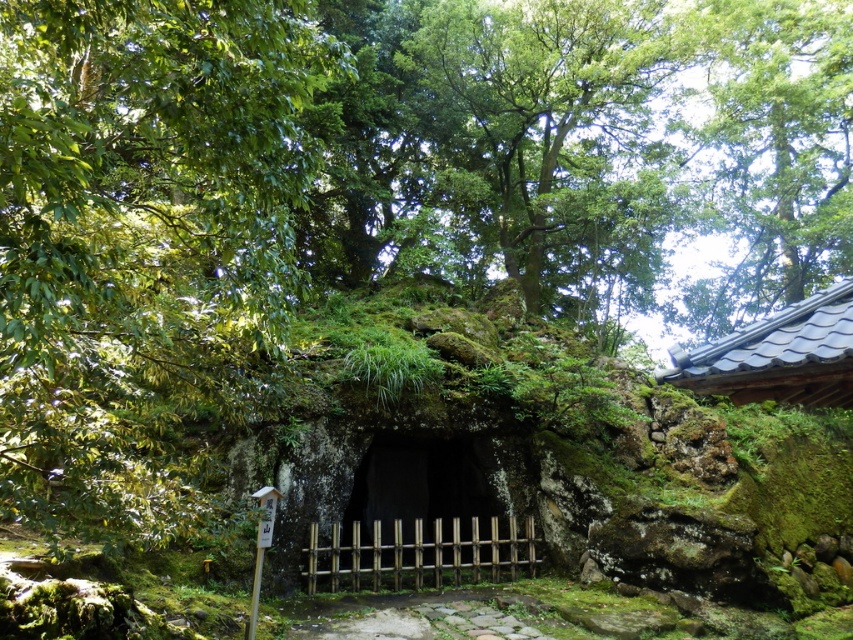
Question: Considering the real-world distances, which object is farthest from the gray tile roof at upper right?

Choices:
 (A) dark brown wooden gate at center
 (B) green leafy tree at upper left

Answer: (A)

Question: Can you confirm if green mossy tree at upper center is positioned above dark brown wooden gate at center?

Choices:
 (A) yes
 (B) no

Answer: (A)

Question: Which is farther from the gray tile roof at upper right?

Choices:
 (A) green leafy tree at upper right
 (B) green leafy tree at upper left
 (C) green mossy tree at upper center
 (D) dark brown wooden gate at center

Answer: (A)

Question: Observing the image, what is the correct spatial positioning of green leafy tree at upper right in reference to gray tile roof at upper right?

Choices:
 (A) left
 (B) right

Answer: (B)

Question: Does green mossy tree at upper center appear on the right side of dark brown wooden gate at center?

Choices:
 (A) yes
 (B) no

Answer: (A)

Question: Which point is closer to the camera taking this photo?

Choices:
 (A) (132, 189)
 (B) (440, 500)

Answer: (A)